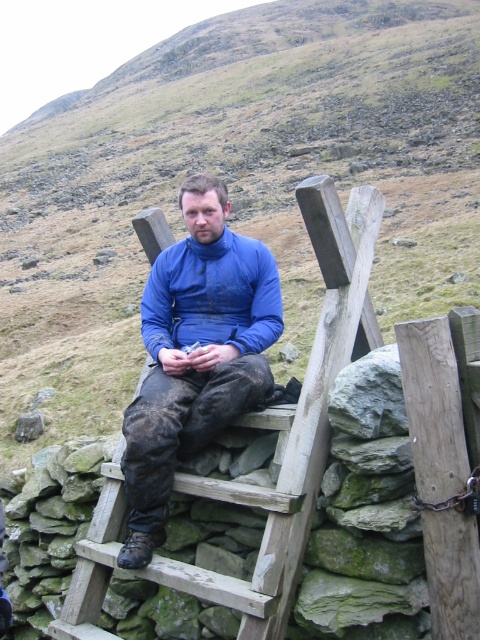
Question: Which point is farther from the camera taking this photo?

Choices:
 (A) (153, 340)
 (B) (98, 582)

Answer: (A)

Question: Which of the following is the closest to the observer?

Choices:
 (A) blue fleece at center
 (B) wooden at center

Answer: (B)

Question: Can you confirm if wooden at center is positioned to the left of blue fleece at center?

Choices:
 (A) no
 (B) yes

Answer: (A)

Question: Is wooden at center to the left of blue fleece at center from the viewer's perspective?

Choices:
 (A) no
 (B) yes

Answer: (A)

Question: Is wooden at center thinner than blue fleece at center?

Choices:
 (A) yes
 (B) no

Answer: (B)